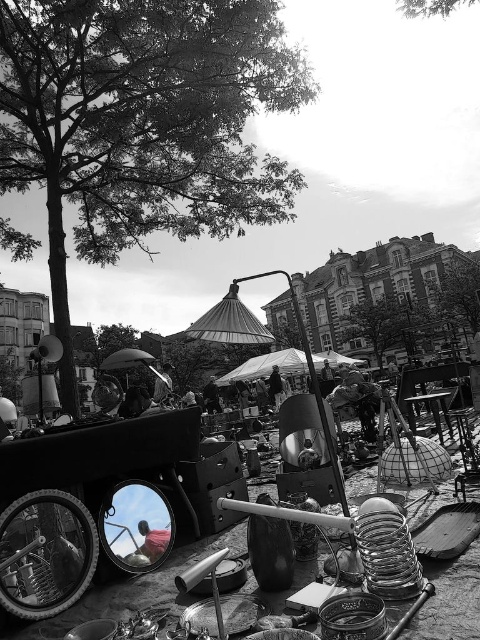
Question: Can you confirm if transparent fabric umbrella at center is bigger than wooden picnic table at center?

Choices:
 (A) yes
 (B) no

Answer: (A)

Question: Which object appears farthest from the camera in this image?

Choices:
 (A) metallic reflective mirror at center
 (B) wooden picnic table at center
 (C) transparent fabric umbrella at center

Answer: (C)

Question: Which point is farther to the camera?

Choices:
 (A) metallic reflective mirror at center
 (B) transparent fabric umbrella at center

Answer: (B)

Question: Among these objects, which one is farthest from the camera?

Choices:
 (A) metallic reflective mirror at center
 (B) wooden picnic table at center
 (C) transparent fabric umbrella at center

Answer: (C)

Question: Does transparent fabric umbrella at center appear over wooden picnic table at center?

Choices:
 (A) yes
 (B) no

Answer: (B)

Question: Observing the image, what is the correct spatial positioning of transparent fabric umbrella at center in reference to wooden picnic table at center?

Choices:
 (A) right
 (B) left

Answer: (B)